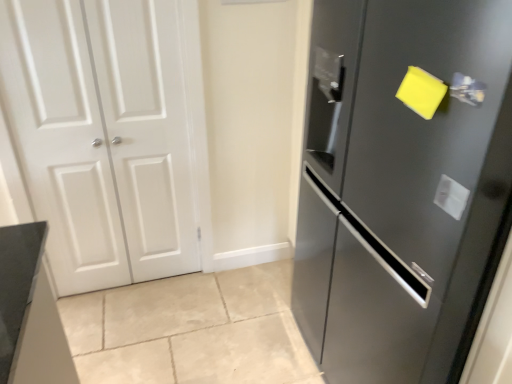
Question: Could satin black refrigerator at right, which ranks as the second door in left-to-right order, be considered to be inside white matte door at left, which is the second door in right-to-left order?

Choices:
 (A) yes
 (B) no

Answer: (B)

Question: From the image's perspective, is white matte door at left, the 1th door from the left, below satin black refrigerator at right, which is counted as the 1th door, starting from the right?

Choices:
 (A) no
 (B) yes

Answer: (A)

Question: Does white matte door at left, which is the second door in right-to-left order, have a lesser height compared to satin black refrigerator at right, which ranks as the second door in left-to-right order?

Choices:
 (A) no
 (B) yes

Answer: (B)

Question: Considering the relative sizes of white matte door at left, which is the second door in right-to-left order, and satin black refrigerator at right, which ranks as the second door in left-to-right order, in the image provided, is white matte door at left, which is the second door in right-to-left order, thinner than satin black refrigerator at right, which ranks as the second door in left-to-right order,?

Choices:
 (A) no
 (B) yes

Answer: (B)

Question: Are white matte door at left, which is the second door in right-to-left order, and satin black refrigerator at right, which ranks as the second door in left-to-right order, beside each other?

Choices:
 (A) no
 (B) yes

Answer: (A)

Question: Is point (450, 87) closer or farther from the camera than point (92, 107)?

Choices:
 (A) closer
 (B) farther

Answer: (A)

Question: Considering the positions of satin silver handle at upper right and white matte door at left, which is the second door in right-to-left order, in the image, is satin silver handle at upper right taller or shorter than white matte door at left, which is the second door in right-to-left order,?

Choices:
 (A) short
 (B) tall

Answer: (A)

Question: From the image's perspective, is satin silver handle at upper right located above or below white matte door at left, the 1th door from the left?

Choices:
 (A) above
 (B) below

Answer: (A)

Question: Considering the relative positions of satin silver handle at upper right and white matte door at left, which is the second door in right-to-left order, in the image provided, is satin silver handle at upper right to the left or to the right of white matte door at left, which is the second door in right-to-left order,?

Choices:
 (A) right
 (B) left

Answer: (A)

Question: In the image, is white matte door at left, the 1th door from the left, positioned in front of or behind satin silver handle at upper right?

Choices:
 (A) front
 (B) behind

Answer: (B)

Question: Is white matte door at left, the 1th door from the left, to the left or to the right of satin silver handle at upper right in the image?

Choices:
 (A) left
 (B) right

Answer: (A)

Question: From a real-world perspective, is white matte door at left, which is the second door in right-to-left order, physically located above or below satin silver handle at upper right?

Choices:
 (A) below
 (B) above

Answer: (A)

Question: In terms of size, does white matte door at left, the 1th door from the left, appear bigger or smaller than satin silver handle at upper right?

Choices:
 (A) small
 (B) big

Answer: (B)

Question: Based on their sizes in the image, would you say white matte door at left, which is the second door in right-to-left order, is bigger or smaller than satin black refrigerator at right, which is counted as the 1th door, starting from the right?

Choices:
 (A) small
 (B) big

Answer: (A)

Question: Considering the positions of point (169, 79) and point (403, 360), is point (169, 79) closer or farther from the camera than point (403, 360)?

Choices:
 (A) closer
 (B) farther

Answer: (B)